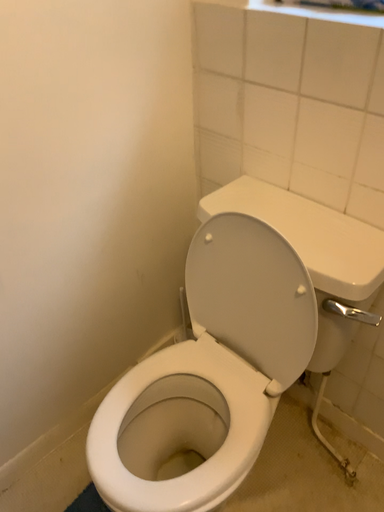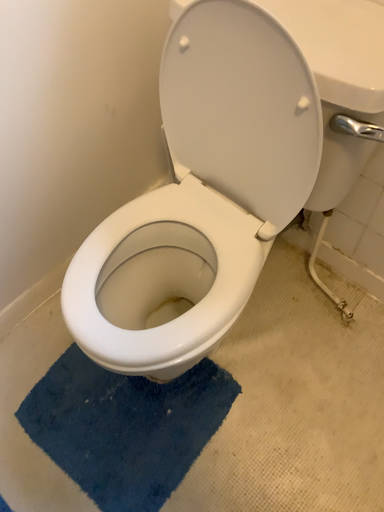
Question: Which way did the camera rotate in the video?

Choices:
 (A) rotated upward
 (B) rotated downward

Answer: (B)